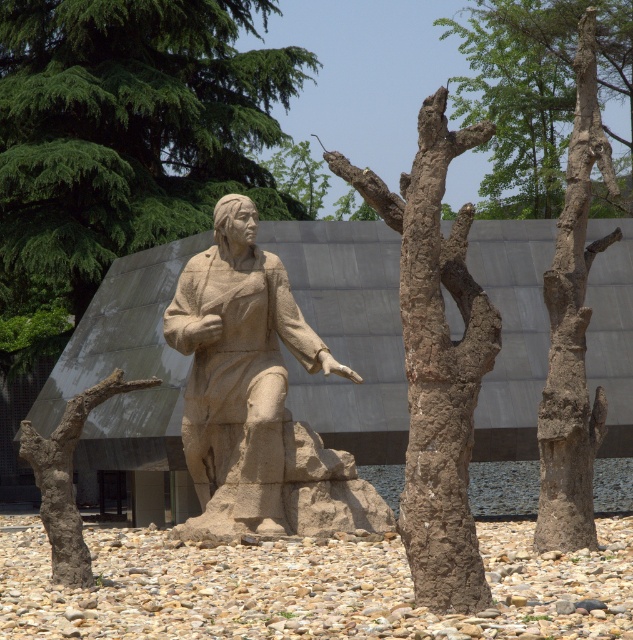
Question: Does brown rough bark at right have a larger size compared to green leafy tree at upper center?

Choices:
 (A) yes
 (B) no

Answer: (A)

Question: Which point appears farthest from the camera in this image?

Choices:
 (A) (204, 269)
 (B) (579, 356)
 (C) (78, 211)

Answer: (C)

Question: Observing the image, what is the correct spatial positioning of brown rough bark tree at upper right in reference to green leafy tree at upper center?

Choices:
 (A) below
 (B) above

Answer: (B)

Question: Which object is closer to the camera taking this photo?

Choices:
 (A) sandstone statue at center
 (B) green leafy tree at upper center

Answer: (A)

Question: Considering the relative positions of brown rough bark at right and green leafy tree at upper center in the image provided, where is brown rough bark at right located with respect to green leafy tree at upper center?

Choices:
 (A) left
 (B) right

Answer: (B)

Question: Estimate the real-world distances between objects in this image. Which object is closer to the green leafy tree at upper center?

Choices:
 (A) green textured tree at upper left
 (B) brown rough bark tree at upper right

Answer: (B)